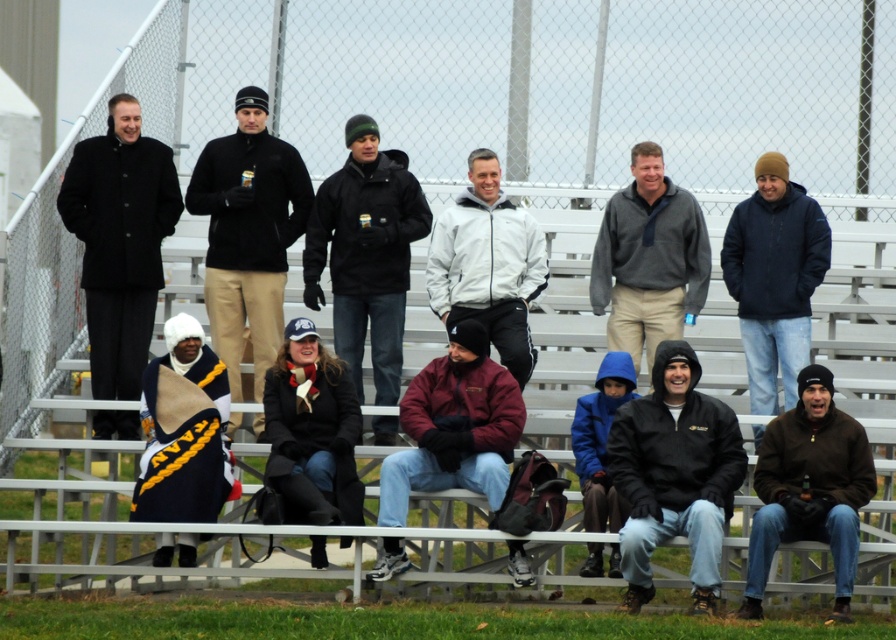
Question: Which object is the closest to the white matte jacket at center?

Choices:
 (A) maroon fleece jacket at center
 (B) gray fleece pullover at center
 (C) black matte jacket at lower center

Answer: (B)

Question: Which point is farther to the camera?

Choices:
 (A) (234, 273)
 (B) (351, 195)

Answer: (A)

Question: Does matte black jacket at center appear on the right side of brown fuzzy jacket at lower right?

Choices:
 (A) no
 (B) yes

Answer: (A)

Question: Is the position of dark blue jacket at right less distant than that of gray fleece pullover at center?

Choices:
 (A) yes
 (B) no

Answer: (A)

Question: Is black matte jacket at lower center to the right of maroon fleece jacket at center from the viewer's perspective?

Choices:
 (A) yes
 (B) no

Answer: (A)

Question: Among these objects, which one is nearest to the camera?

Choices:
 (A) white matte jacket at center
 (B) gray fleece pullover at center

Answer: (A)